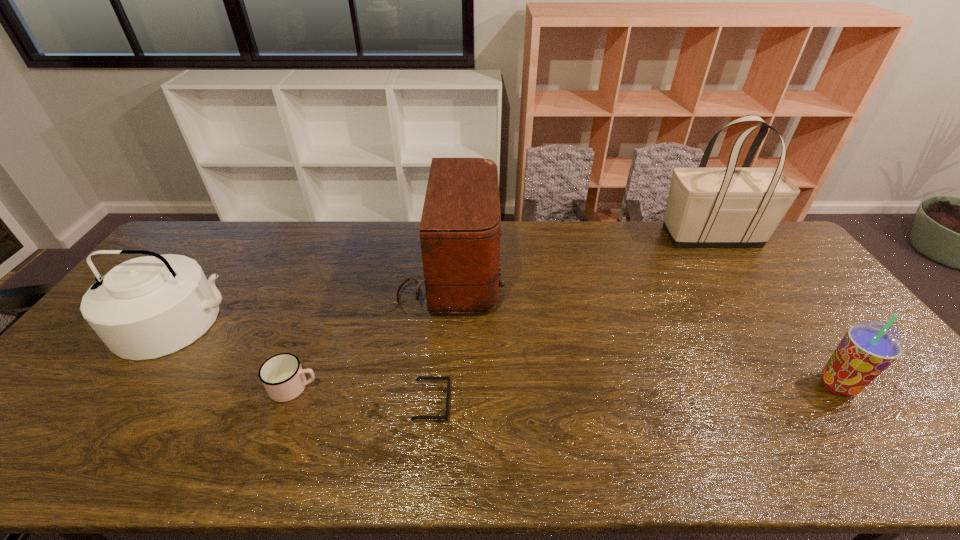
Find the location of a particular element. This screenshot has height=540, width=960. vacant space that satisfies the following two spatial constraints: 1. on the front panel of the radio receiver; 2. on the spout of the kettle is located at coordinates (444, 322).

You are a GUI agent. You are given a task and a screenshot of the screen. Output one action in this format:
    pyautogui.click(x=<x>, y=<y>)
    Task: Click on the vacant region that satisfies the following two spatial constraints: 1. on the front panel of the smoothie; 2. on the right side of the fifth shortest object
    Image resolution: width=960 pixels, height=540 pixels.
    Given the screenshot: What is the action you would take?
    pyautogui.click(x=439, y=385)

The height and width of the screenshot is (540, 960). What are the coordinates of `blank area in the image that satisfies the following two spatial constraints: 1. with handles facing forward on the shopping bag; 2. on the left side of the smoothie` in the screenshot? It's located at (811, 385).

The image size is (960, 540). In order to click on free space that satisfies the following two spatial constraints: 1. on the front panel of the radio receiver; 2. on the back side of the smoothie in this screenshot , I will do `click(439, 385)`.